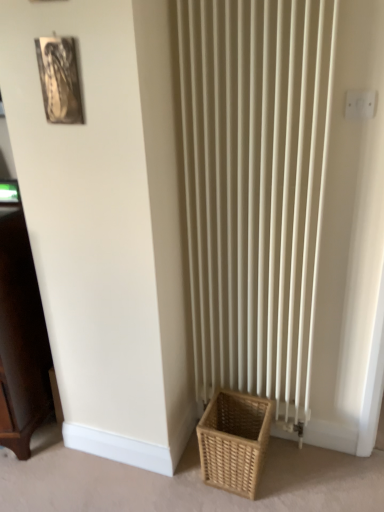
Question: Can you confirm if white plastic electric outlet at upper right is taller than dark wood cabinet at left?

Choices:
 (A) yes
 (B) no

Answer: (B)

Question: Does white plastic electric outlet at upper right have a smaller size compared to dark wood cabinet at left?

Choices:
 (A) no
 (B) yes

Answer: (B)

Question: From the image's perspective, is white plastic electric outlet at upper right on dark wood cabinet at left?

Choices:
 (A) yes
 (B) no

Answer: (A)

Question: Is white plastic electric outlet at upper right completely or partially outside of dark wood cabinet at left?

Choices:
 (A) yes
 (B) no

Answer: (A)

Question: Is white plastic electric outlet at upper right positioned in front of dark wood cabinet at left?

Choices:
 (A) yes
 (B) no

Answer: (A)

Question: Is white plastic electric outlet at upper right touching dark wood cabinet at left?

Choices:
 (A) no
 (B) yes

Answer: (A)

Question: From the image's perspective, is white plastic electric outlet at upper right above natural woven basket at lower right?

Choices:
 (A) yes
 (B) no

Answer: (A)

Question: Can you confirm if white plastic electric outlet at upper right is shorter than natural woven basket at lower right?

Choices:
 (A) yes
 (B) no

Answer: (A)

Question: Is white plastic electric outlet at upper right touching natural woven basket at lower right?

Choices:
 (A) no
 (B) yes

Answer: (A)

Question: Can you confirm if white plastic electric outlet at upper right is thinner than natural woven basket at lower right?

Choices:
 (A) yes
 (B) no

Answer: (A)

Question: Can you confirm if white plastic electric outlet at upper right is bigger than natural woven basket at lower right?

Choices:
 (A) no
 (B) yes

Answer: (A)

Question: Considering the relative sizes of white plastic electric outlet at upper right and natural woven basket at lower right in the image provided, is white plastic electric outlet at upper right wider than natural woven basket at lower right?

Choices:
 (A) yes
 (B) no

Answer: (B)

Question: Does natural woven basket at lower right have a greater width compared to white plastic electric outlet at upper right?

Choices:
 (A) yes
 (B) no

Answer: (A)